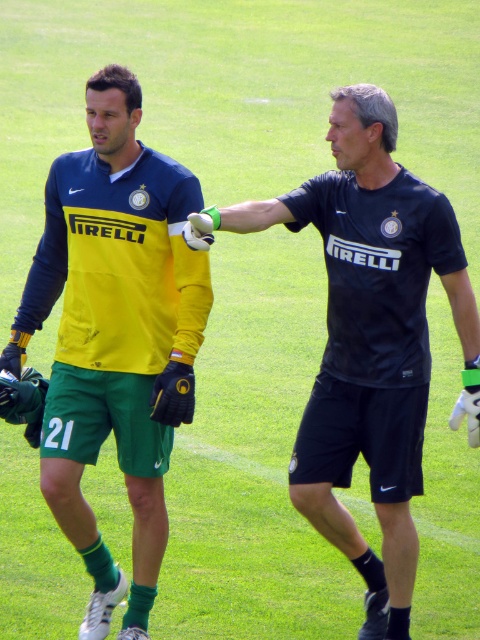
Question: In this image, where is yellow matte jersey at left located relative to black matte shirt at center?

Choices:
 (A) left
 (B) right

Answer: (A)

Question: Which point is farther to the camera?

Choices:
 (A) yellow matte jersey at left
 (B) black matte shirt at center

Answer: (A)

Question: Considering the relative positions of yellow matte jersey at left and black matte shirt at center in the image provided, where is yellow matte jersey at left located with respect to black matte shirt at center?

Choices:
 (A) left
 (B) right

Answer: (A)

Question: Is yellow matte jersey at left to the right of black matte shirt at center from the viewer's perspective?

Choices:
 (A) no
 (B) yes

Answer: (A)

Question: Which object appears farthest from the camera in this image?

Choices:
 (A) black matte shirt at center
 (B) yellow matte jersey at left

Answer: (B)